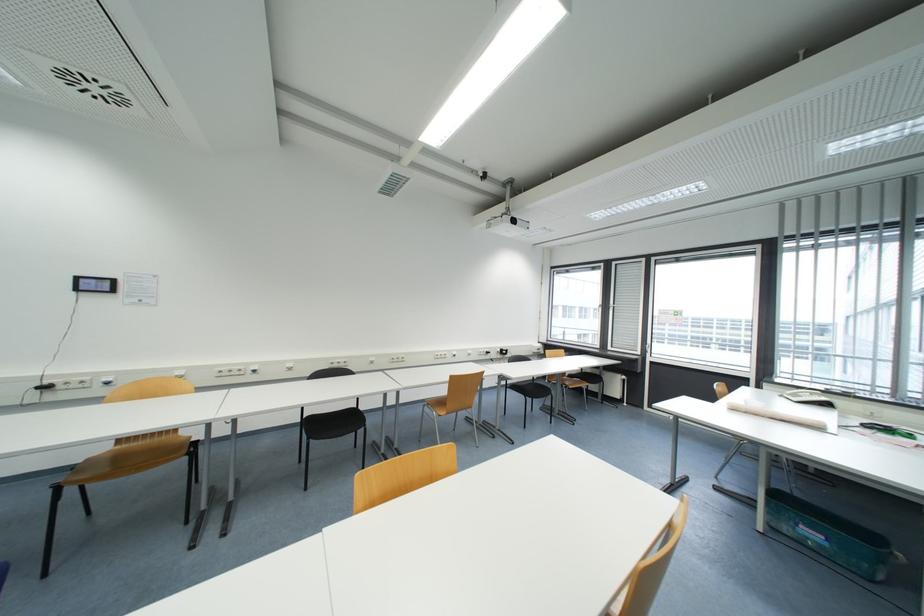
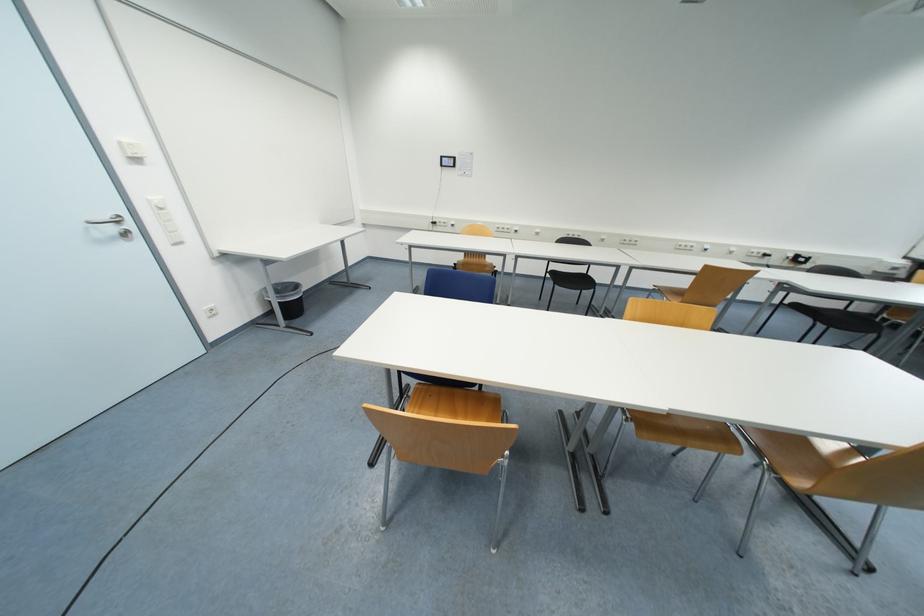
Locate, in the second image, the point that corresponds to the point at 295,371 in the first image.

(541, 236)